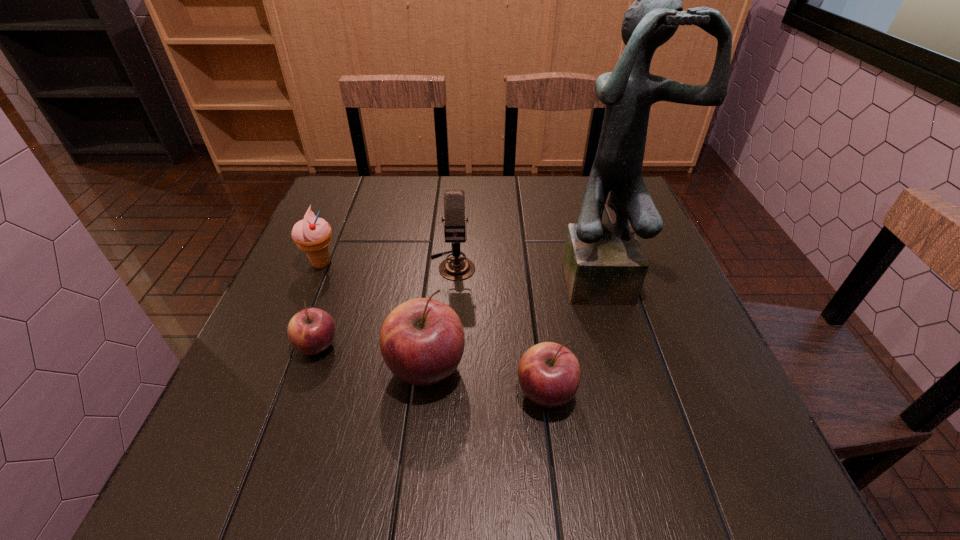
In the image, there is a desktop. Identify the location of free space at the left edge. (354, 255).

At what (x,y) coordinates should I click in order to perform the action: click on free point at the right edge. Please return your answer as a coordinate pair (x, y). The width and height of the screenshot is (960, 540). Looking at the image, I should click on (694, 346).

I want to click on free space between the second apple from right to left and the icecream, so click(373, 316).

Locate an element on the screen. The width and height of the screenshot is (960, 540). free space between the shortest apple and the tallest apple is located at coordinates (372, 357).

Find the location of a particular element. The width and height of the screenshot is (960, 540). vacant region between the tallest object and the microphone is located at coordinates (529, 270).

Where is `free area in between the second object from right to left and the tallest apple`? The height and width of the screenshot is (540, 960). free area in between the second object from right to left and the tallest apple is located at coordinates (486, 381).

You are a GUI agent. You are given a task and a screenshot of the screen. Output one action in this format:
    pyautogui.click(x=<x>, y=<y>)
    Task: Click on the vacant space in between the microphone and the shortest apple
    Image resolution: width=960 pixels, height=540 pixels.
    Given the screenshot: What is the action you would take?
    pyautogui.click(x=385, y=306)

Where is `free space between the microphone and the fifth object from left to right`? free space between the microphone and the fifth object from left to right is located at coordinates (499, 329).

Locate an element on the screen. Image resolution: width=960 pixels, height=540 pixels. free space between the shortest apple and the second apple from left to right is located at coordinates (372, 357).

At what (x,y) coordinates should I click in order to perform the action: click on vacant area that lies between the sculpture and the second apple from right to left. Please return your answer as a coordinate pair (x, y). Looking at the image, I should click on (516, 322).